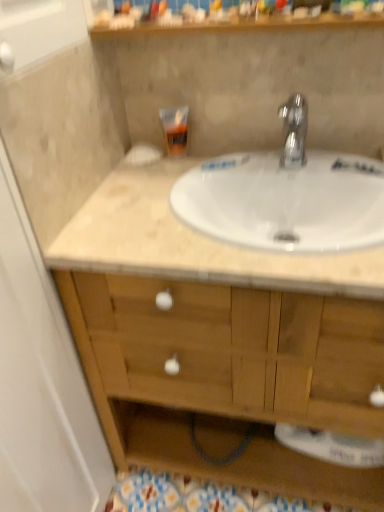
Question: Can you confirm if polished chrome faucet at upper center is bigger than wooden cabinet at center?

Choices:
 (A) yes
 (B) no

Answer: (B)

Question: Considering the relative sizes of polished chrome faucet at upper center and wooden cabinet at center in the image provided, is polished chrome faucet at upper center taller than wooden cabinet at center?

Choices:
 (A) no
 (B) yes

Answer: (A)

Question: Considering the relative positions of polished chrome faucet at upper center and wooden cabinet at center in the image provided, is polished chrome faucet at upper center to the right of wooden cabinet at center from the viewer's perspective?

Choices:
 (A) no
 (B) yes

Answer: (B)

Question: Is polished chrome faucet at upper center turned away from wooden cabinet at center?

Choices:
 (A) yes
 (B) no

Answer: (B)

Question: From a real-world perspective, is polished chrome faucet at upper center located higher than wooden cabinet at center?

Choices:
 (A) no
 (B) yes

Answer: (B)

Question: Is polished chrome faucet at upper center smaller than wooden cabinet at center?

Choices:
 (A) yes
 (B) no

Answer: (A)

Question: From the image's perspective, is translucent plastic tube at upper center located above wooden shelf at upper center?

Choices:
 (A) yes
 (B) no

Answer: (B)

Question: Is translucent plastic tube at upper center smaller than wooden shelf at upper center?

Choices:
 (A) yes
 (B) no

Answer: (A)

Question: Considering the relative positions of translucent plastic tube at upper center and wooden shelf at upper center in the image provided, is translucent plastic tube at upper center to the left of wooden shelf at upper center from the viewer's perspective?

Choices:
 (A) yes
 (B) no

Answer: (A)

Question: Can you confirm if translucent plastic tube at upper center is shorter than wooden shelf at upper center?

Choices:
 (A) yes
 (B) no

Answer: (B)

Question: Does translucent plastic tube at upper center come behind wooden shelf at upper center?

Choices:
 (A) yes
 (B) no

Answer: (A)

Question: From a real-world perspective, is translucent plastic tube at upper center located beneath wooden shelf at upper center?

Choices:
 (A) no
 (B) yes

Answer: (B)

Question: Does wooden shelf at upper center have a lesser height compared to polished chrome faucet at upper center?

Choices:
 (A) no
 (B) yes

Answer: (B)